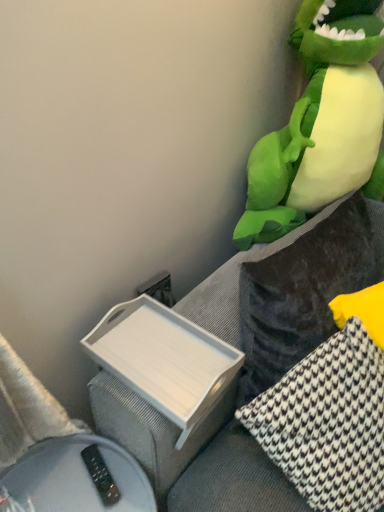
Where is `white houndstooth pillow at right, which ranks as the 2th pillow in left-to-right order`? The width and height of the screenshot is (384, 512). white houndstooth pillow at right, which ranks as the 2th pillow in left-to-right order is located at coordinates tap(305, 291).

Describe the element at coordinates (164, 360) in the screenshot. I see `white wood tray at lower left` at that location.

In order to click on velvet dark gray couch at right in this screenshot , I will do `click(151, 429)`.

What do you see at coordinates (321, 123) in the screenshot? The width and height of the screenshot is (384, 512). I see `green plush toy at upper right` at bounding box center [321, 123].

Identify the location of white houndstooth pillow at right, marked as the 1th pillow in a right-to-left arrangement. (305, 291).

What's the angular difference between green plush toy at upper right and velvet dark gray couch at right's facing directions?

The angle between the facing direction of green plush toy at upper right and the facing direction of velvet dark gray couch at right is 80.5 degrees.

Which of these two, green plush toy at upper right or velvet dark gray couch at right, stands shorter?

With less height is velvet dark gray couch at right.

Is green plush toy at upper right next to velvet dark gray couch at right?

They are not placed beside each other.

Does velvet dark gray couch at right have a smaller size compared to white wood tray at lower left?

No, velvet dark gray couch at right is not smaller than white wood tray at lower left.

Considering the positions of objects velvet dark gray couch at right and white wood tray at lower left in the image provided, who is in front, velvet dark gray couch at right or white wood tray at lower left?

velvet dark gray couch at right is in front.

Which of these two, velvet dark gray couch at right or white wood tray at lower left, is wider?

white wood tray at lower left.

In the scene shown: From a real-world perspective, is white plastic tray at lower left on top of white houndstooth pillow at right, marked as the 1th pillow in a right-to-left arrangement?

No, from a real-world perspective, white plastic tray at lower left is not above white houndstooth pillow at right, marked as the 1th pillow in a right-to-left arrangement.

Does white plastic tray at lower left appear on the left side of white houndstooth pillow at right, which ranks as the 2th pillow in left-to-right order?

Correct, you'll find white plastic tray at lower left to the left of white houndstooth pillow at right, which ranks as the 2th pillow in left-to-right order.

Does white plastic tray at lower left have a greater height compared to white houndstooth pillow at right, which ranks as the 2th pillow in left-to-right order?

No, white plastic tray at lower left is not taller than white houndstooth pillow at right, which ranks as the 2th pillow in left-to-right order.

Considering the sizes of objects white plastic tray at lower left and white houndstooth pillow at right, marked as the 1th pillow in a right-to-left arrangement, in the image provided, who is bigger, white plastic tray at lower left or white houndstooth pillow at right, marked as the 1th pillow in a right-to-left arrangement,?

white houndstooth pillow at right, marked as the 1th pillow in a right-to-left arrangement, is bigger.

Can you confirm if white plastic tray at lower left is shorter than green plush toy at upper right?

Yes.

Considering the positions of objects white plastic tray at lower left and green plush toy at upper right in the image provided, who is more to the right, white plastic tray at lower left or green plush toy at upper right?

green plush toy at upper right is more to the right.

Which object is more forward, white plastic tray at lower left or green plush toy at upper right?

Positioned in front is green plush toy at upper right.

Can you confirm if white plastic tray at lower left is bigger than green plush toy at upper right?

Incorrect, white plastic tray at lower left is not larger than green plush toy at upper right.

From a real-world perspective, which object stands above the other?

white houndstooth pillow at right, which ranks as the 2th pillow in left-to-right order, is physically above.

Who is bigger, white houndstooth fabric pillow at right, which appears as the 1th pillow when viewed from the left, or white houndstooth pillow at right, which ranks as the 2th pillow in left-to-right order?

white houndstooth pillow at right, which ranks as the 2th pillow in left-to-right order, is bigger.

From the image's perspective, who appears lower, white houndstooth fabric pillow at right, which appears as the 1th pillow when viewed from the left, or white houndstooth pillow at right, marked as the 1th pillow in a right-to-left arrangement?

From the image's view, white houndstooth fabric pillow at right, which appears as the 1th pillow when viewed from the left, is below.

Which is behind, green plush toy at upper right or white wood tray at lower left?

white wood tray at lower left.

Looking at this image, looking at their sizes, would you say green plush toy at upper right is wider or thinner than white wood tray at lower left?

In the image, green plush toy at upper right appears to be wider than white wood tray at lower left.

From the image's perspective, is green plush toy at upper right above or below white wood tray at lower left?

Clearly, from the image's perspective, green plush toy at upper right is above white wood tray at lower left.

What's the angular difference between white wood tray at lower left and green plush toy at upper right's facing directions?

The angle between the facing direction of white wood tray at lower left and the facing direction of green plush toy at upper right is 90 degrees.

Is white wood tray at lower left outside of green plush toy at upper right?

Absolutely, white wood tray at lower left is external to green plush toy at upper right.

Does white wood tray at lower left have a lesser width compared to green plush toy at upper right?

Indeed, white wood tray at lower left has a lesser width compared to green plush toy at upper right.

From the image's perspective, which one is positioned lower, white wood tray at lower left or green plush toy at upper right?

From the image's view, white wood tray at lower left is below.

You are a GUI agent. You are given a task and a screenshot of the screen. Output one action in this format:
    pyautogui.click(x=<x>, y=<y>)
    Task: Click on the couch that is behind the green plush toy at upper right
    The height and width of the screenshot is (512, 384).
    Given the screenshot: What is the action you would take?
    pyautogui.click(x=151, y=429)

In the image, there is a velvet dark gray couch at right. At what (x,y) coordinates should I click in order to perform the action: click on box below it (from the image's perspective). Please return your answer as a coordinate pair (x, y). Looking at the image, I should click on (164, 360).

Based on their spatial positions, is white houndstooth pillow at right, marked as the 1th pillow in a right-to-left arrangement, or green plush toy at upper right closer to white wood tray at lower left?

Among the two, white houndstooth pillow at right, marked as the 1th pillow in a right-to-left arrangement, is located nearer to white wood tray at lower left.

Based on their spatial positions, is green plush toy at upper right or white houndstooth fabric pillow at right, the 2th pillow positioned from the right, closer to velvet dark gray couch at right?

Among the two, white houndstooth fabric pillow at right, the 2th pillow positioned from the right, is located nearer to velvet dark gray couch at right.

Which object lies nearer to the anchor point white houndstooth fabric pillow at right, which appears as the 1th pillow when viewed from the left, white houndstooth pillow at right, which ranks as the 2th pillow in left-to-right order, or velvet dark gray couch at right?

white houndstooth pillow at right, which ranks as the 2th pillow in left-to-right order, is closer to white houndstooth fabric pillow at right, which appears as the 1th pillow when viewed from the left.

Considering their positions, is white plastic tray at lower left positioned closer to white wood tray at lower left than velvet dark gray couch at right?

Based on the image, velvet dark gray couch at right appears to be nearer to white wood tray at lower left.

When comparing their distances from white wood tray at lower left, does white plastic tray at lower left or white houndstooth pillow at right, marked as the 1th pillow in a right-to-left arrangement, seem closer?

white houndstooth pillow at right, marked as the 1th pillow in a right-to-left arrangement, is closer to white wood tray at lower left.

Which object lies nearer to the anchor point white houndstooth pillow at right, marked as the 1th pillow in a right-to-left arrangement, velvet dark gray couch at right or green plush toy at upper right?

velvet dark gray couch at right.

Based on the photo, when comparing their distances from green plush toy at upper right, does white plastic tray at lower left or velvet dark gray couch at right seem closer?

The object closer to green plush toy at upper right is velvet dark gray couch at right.

Looking at the image, which one is located closer to white plastic tray at lower left, velvet dark gray couch at right or green plush toy at upper right?

Among the two, velvet dark gray couch at right is located nearer to white plastic tray at lower left.

The image size is (384, 512). In order to click on couch between green plush toy at upper right and white houndstooth fabric pillow at right, the 2th pillow positioned from the right, from top to bottom in this screenshot , I will do `click(151, 429)`.

The width and height of the screenshot is (384, 512). In order to click on couch between white wood tray at lower left and white houndstooth pillow at right, marked as the 1th pillow in a right-to-left arrangement, from left to right in this screenshot , I will do `click(151, 429)`.

The width and height of the screenshot is (384, 512). What are the coordinates of `pillow located between white wood tray at lower left and white houndstooth pillow at right, marked as the 1th pillow in a right-to-left arrangement, in the left-right direction` in the screenshot? It's located at (328, 423).

Where is `pillow situated between white plastic tray at lower left and white houndstooth pillow at right, which ranks as the 2th pillow in left-to-right order, from left to right`? The height and width of the screenshot is (512, 384). pillow situated between white plastic tray at lower left and white houndstooth pillow at right, which ranks as the 2th pillow in left-to-right order, from left to right is located at coordinates (328, 423).